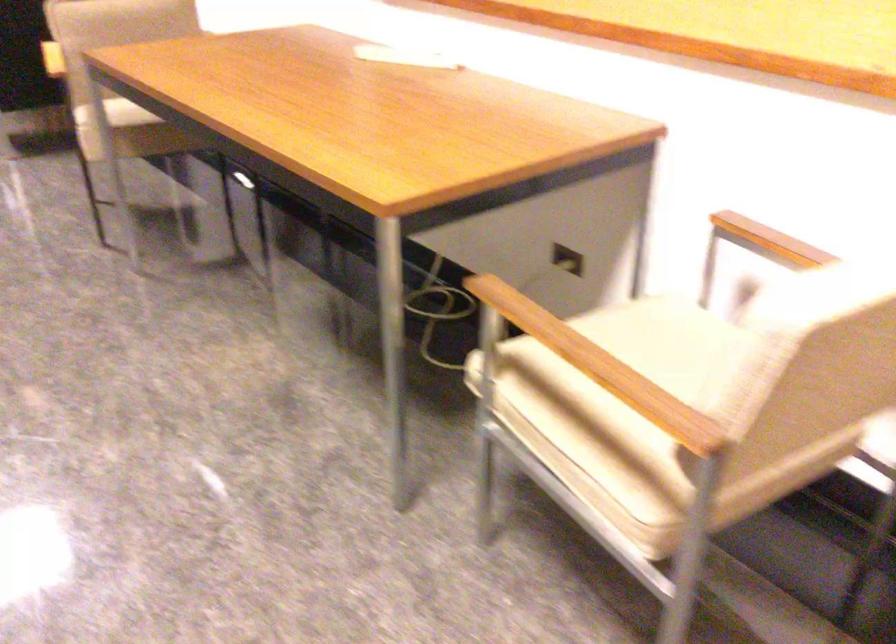
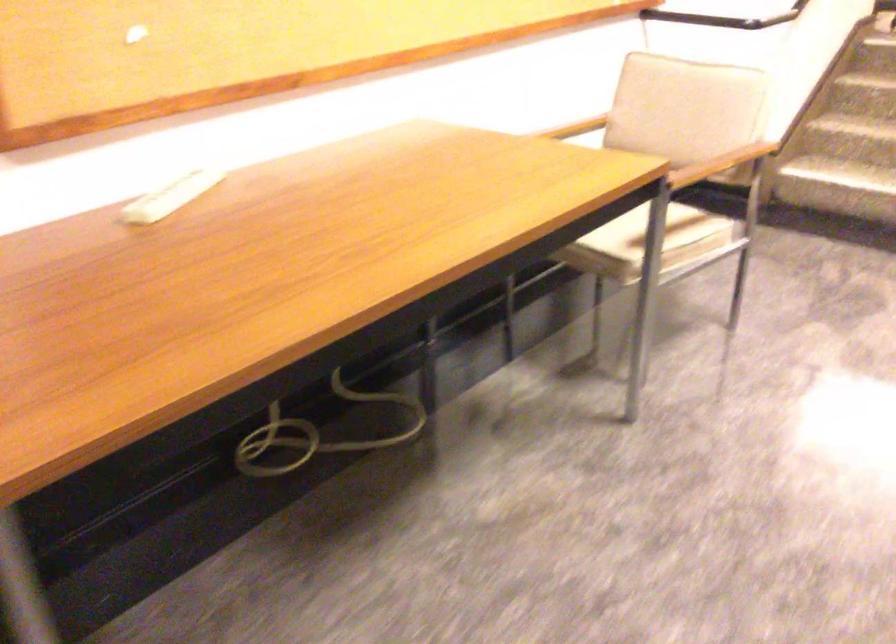
Question: I am providing you with two images of the same scene from different viewpoints. Which of the following objects are not visible in image2?

Choices:
 (A) black stair handrail
 (B) wooden chair armrest
 (C) coiled yellow cord
 (D) pink flower vase

Answer: (B)